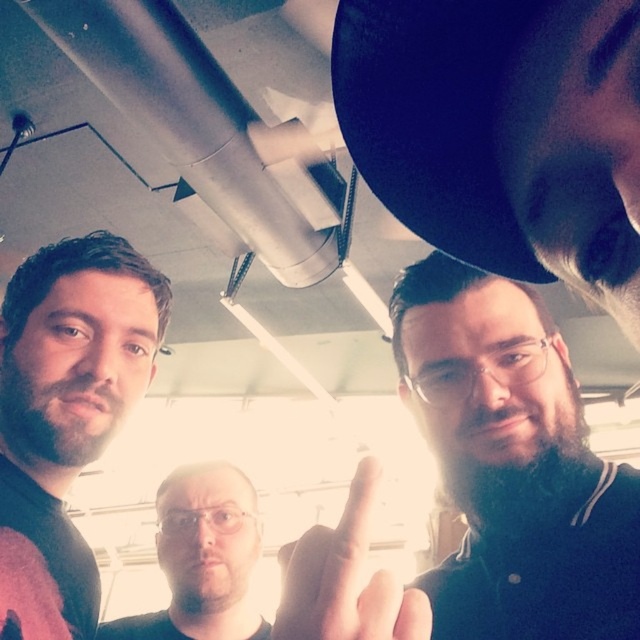
In the scene shown: You are observing a group of people in a workshop. You notice a matte black shirt at left and a clear plastic glasses at center. Which object is positioned higher in the image?

The matte black shirt at left is located above the clear plastic glasses at center.

From the picture: You are a photographer in this indoor setting. You need to adjust your camera to focus on both the dark brown hair at upper center and the clear plastic glasses at center. Which object should you focus on first to ensure both are in focus?

The dark brown hair at upper center is positioned over the clear plastic glasses at center, so you should focus on the dark brown hair at upper center first to ensure both are in focus.

You are a photographer setting up a shot in this workshop scene. You notice the clear plastic glasses at center and the matte skin hand at center. Which object would appear larger in your photo if you focus on the closer one?

The clear plastic glasses at center is further to the viewer than the matte skin hand at center, so focusing on the closer matte skin hand at center would make it appear larger in the photo.